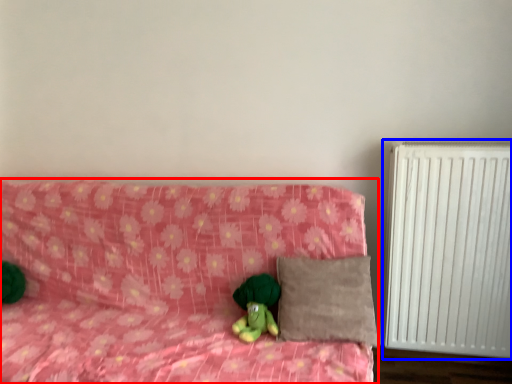
Question: Which of the following is the farthest to the observer, furniture (highlighted by a red box) or radiator (highlighted by a blue box)?

Choices:
 (A) furniture
 (B) radiator

Answer: (B)